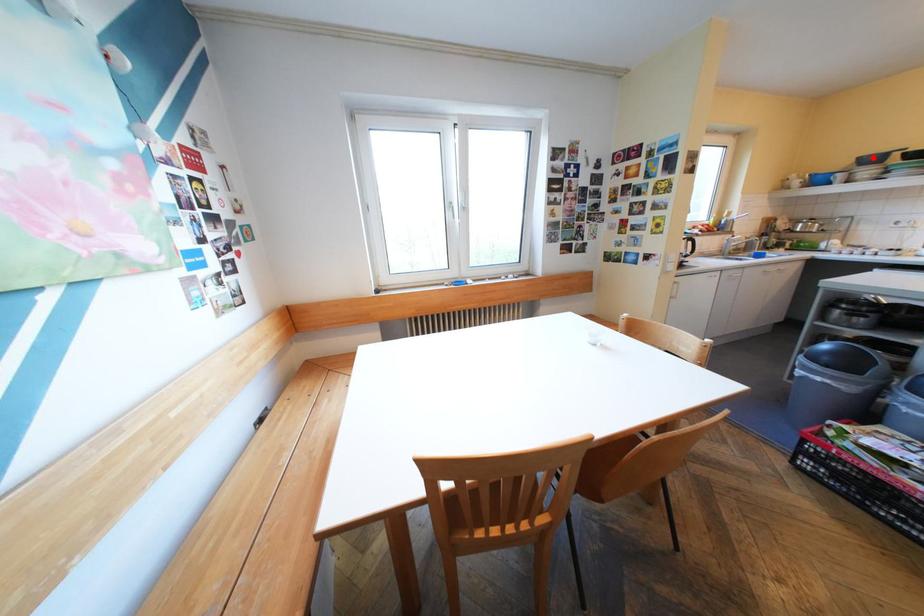
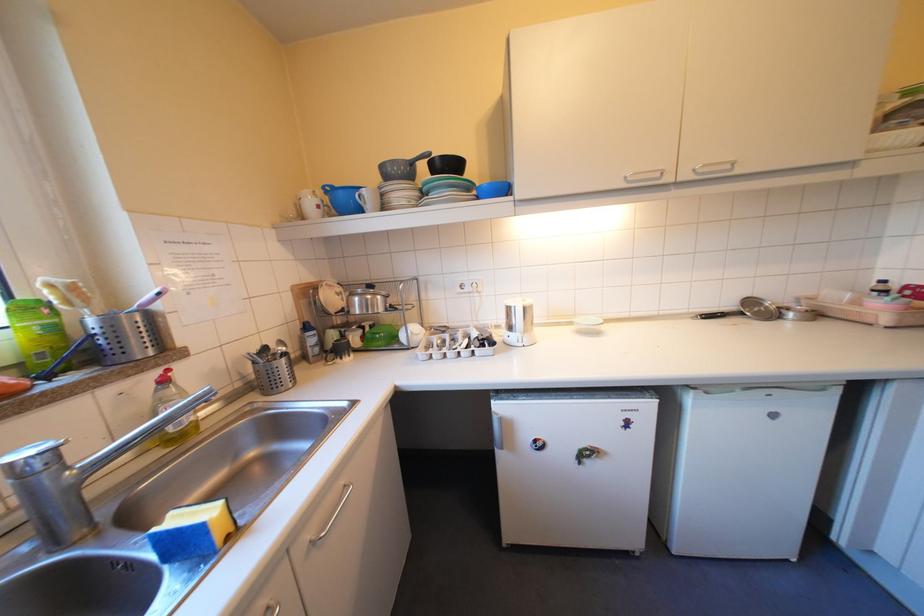
Question: A red point is marked in image1. In image2, is the corresponding 3D point closer to the camera or farther? Reply with the corresponding letter.

Choices:
 (A) The corresponding 3D point is closer.
 (B) The corresponding 3D point is farther.

Answer: (A)